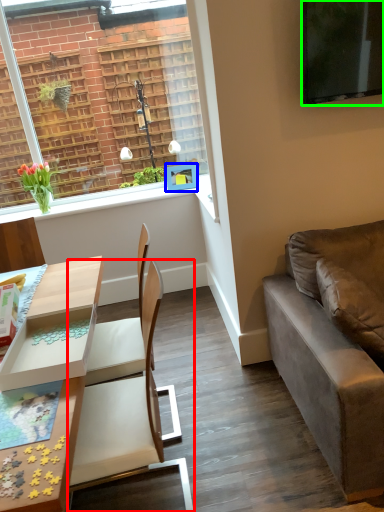
Question: Which object is positioned farthest from chair (highlighted by a red box)? Select from picture frame (highlighted by a blue box) and television (highlighted by a green box).

Choices:
 (A) picture frame
 (B) television

Answer: (A)